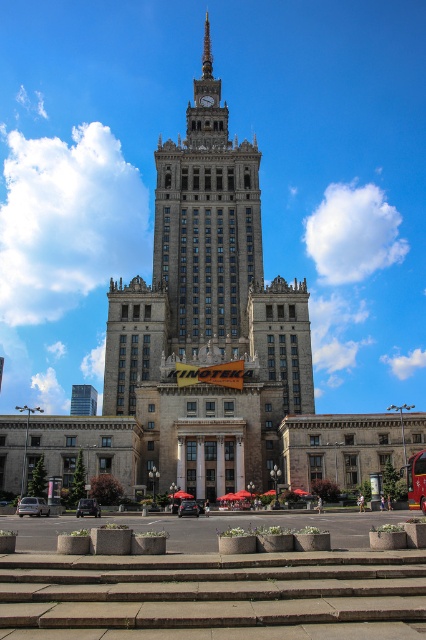
Does brown stone stairs at center have a smaller size compared to yellow metallic bus at center?

Yes, brown stone stairs at center is smaller than yellow metallic bus at center.

Does point (204, 602) come closer to viewer compared to point (423, 488)?

That is True.

This screenshot has height=640, width=426. I want to click on brown stone stairs at center, so 210,589.

Does brown stone stairs at center appear on the left side of stone clock tower at center?

Incorrect, brown stone stairs at center is not on the left side of stone clock tower at center.

Can you confirm if brown stone stairs at center is positioned above stone clock tower at center?

Actually, brown stone stairs at center is below stone clock tower at center.

Between point (302, 572) and point (181, 332), which one is positioned behind?

The point (181, 332) is behind.

The width and height of the screenshot is (426, 640). What are the coordinates of `brown stone stairs at center` in the screenshot? It's located at (210, 589).

Can you confirm if stone clock tower at center is bigger than yellow metallic bus at center?

Correct, stone clock tower at center is larger in size than yellow metallic bus at center.

Identify the location of stone clock tower at center. click(x=207, y=221).

Does point (199, 308) come in front of point (420, 509)?

No.

The image size is (426, 640). What are the coordinates of `stone clock tower at center` in the screenshot? It's located at (207, 221).